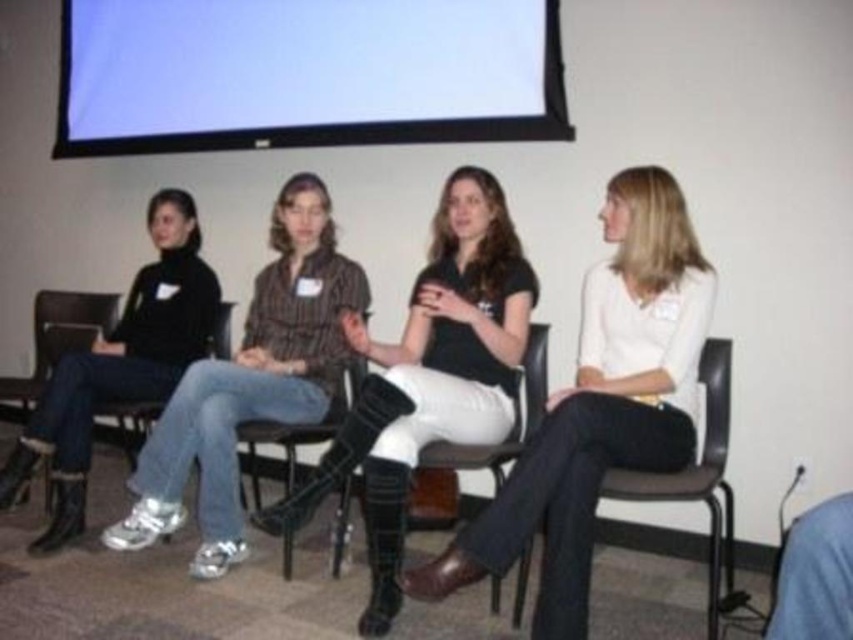
Can you confirm if white matte projection screen at upper center is positioned to the right of black leather boots at center?

Incorrect, white matte projection screen at upper center is not on the right side of black leather boots at center.

Based on the photo, is white matte projection screen at upper center wider than black leather boots at center?

Yes, white matte projection screen at upper center is wider than black leather boots at center.

This screenshot has height=640, width=853. Describe the element at coordinates (305, 74) in the screenshot. I see `white matte projection screen at upper center` at that location.

You are a GUI agent. You are given a task and a screenshot of the screen. Output one action in this format:
    pyautogui.click(x=<x>, y=<y>)
    Task: Click on the white matte projection screen at upper center
    This screenshot has width=853, height=640.
    Given the screenshot: What is the action you would take?
    pyautogui.click(x=305, y=74)

Is matte black shirt at center above black leather boots at center?

Incorrect, matte black shirt at center is not positioned above black leather boots at center.

Is matte black shirt at center thinner than black leather boots at center?

No, matte black shirt at center is not thinner than black leather boots at center.

This screenshot has height=640, width=853. Describe the element at coordinates (599, 404) in the screenshot. I see `matte black shirt at center` at that location.

I want to click on matte black shirt at center, so click(599, 404).

Between matte black shirt at center and black leather chair at center, which one appears on the left side from the viewer's perspective?

black leather chair at center

Can you confirm if matte black shirt at center is bigger than black leather chair at center?

Yes, matte black shirt at center is bigger than black leather chair at center.

Measure the distance between matte black shirt at center and camera.

They are 6.87 feet apart.

At what (x,y) coordinates should I click in order to perform the action: click on matte black shirt at center. Please return your answer as a coordinate pair (x, y). This screenshot has height=640, width=853. Looking at the image, I should click on (599, 404).